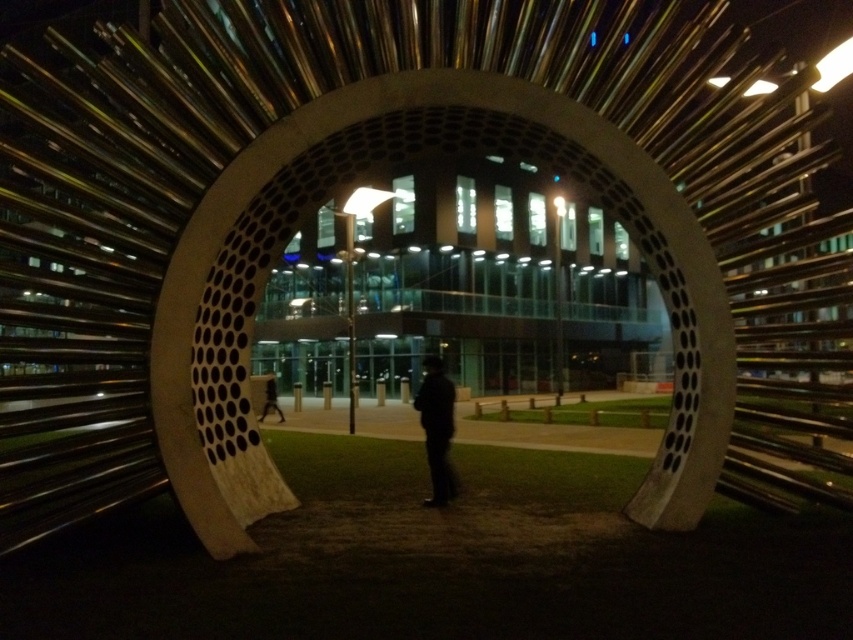
Question: Does black matte jacket at center have a lesser width compared to dark clothing figure at center?

Choices:
 (A) no
 (B) yes

Answer: (A)

Question: Which point is closer to the camera taking this photo?

Choices:
 (A) (276, 394)
 (B) (425, 358)

Answer: (A)

Question: Which point appears farthest from the camera in this image?

Choices:
 (A) tap(444, 472)
 (B) tap(276, 410)

Answer: (B)

Question: Considering the relative positions of black matte jacket at center and dark clothing figure at center in the image provided, where is black matte jacket at center located with respect to dark clothing figure at center?

Choices:
 (A) right
 (B) left

Answer: (A)

Question: Can you confirm if black matte jacket at center is bigger than dark clothing figure at center?

Choices:
 (A) no
 (B) yes

Answer: (B)

Question: Among these points, which one is nearest to the camera?

Choices:
 (A) (267, 384)
 (B) (445, 500)

Answer: (B)